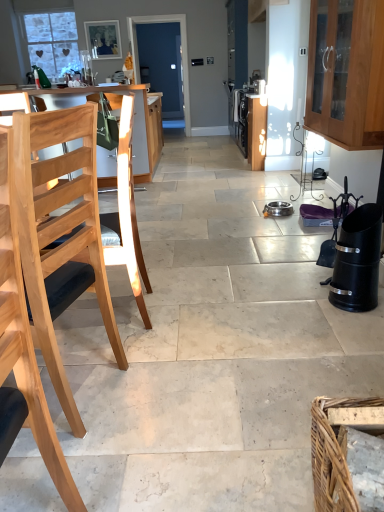
Question: From a real-world perspective, is wooden cabinet at upper right, the 2th cabinetry when ordered from back to front, above or below wooden chair at left, marked as the second cabinetry in a front-to-back arrangement?

Choices:
 (A) above
 (B) below

Answer: (A)

Question: Is point (332, 132) closer or farther from the camera than point (109, 97)?

Choices:
 (A) closer
 (B) farther

Answer: (A)

Question: Which object is the farthest from the wooden cabinet at upper right, acting as the second cabinetry starting from the left?

Choices:
 (A) light wood table at left
 (B) white frosted glass window at upper left
 (C) blue glass door at center
 (D) brown woven basket at lower right
 (E) wooden chair at left, marked as the second cabinetry in a front-to-back arrangement

Answer: (C)

Question: Based on their relative distances, which object is nearer to the natural wood chair at left?

Choices:
 (A) blue glass door at center
 (B) wooden cabinet at upper right, which appears as the first cabinetry when viewed from the front
 (C) wooden chair at left, the 1th cabinetry in the left-to-right sequence
 (D) light wood table at left
 (E) brown woven basket at lower right

Answer: (E)